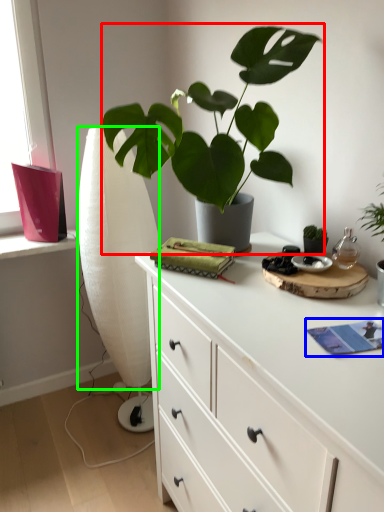
Question: Which object is positioned closest to houseplant (highlighted by a red box)? Select from book (highlighted by a blue box) and curtain (highlighted by a green box).

Choices:
 (A) book
 (B) curtain

Answer: (A)